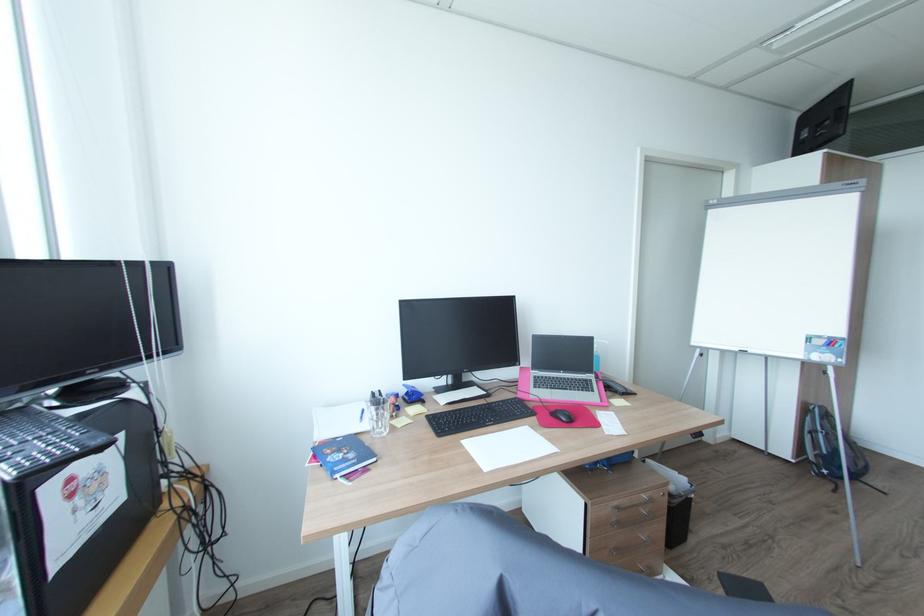
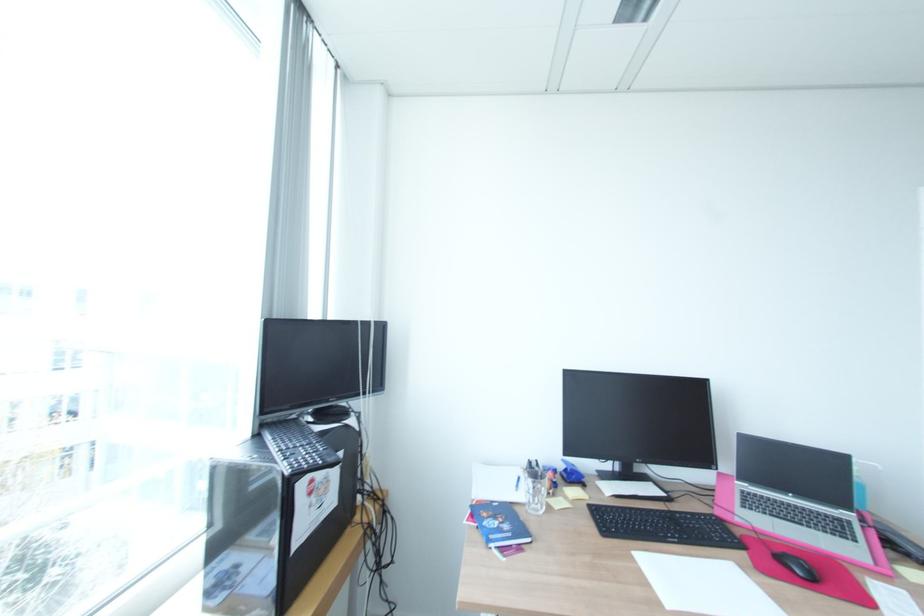
Question: Based on the continuous images, in which direction is the camera rotating? Reply with the corresponding letter.

Choices:
 (A) Left
 (B) Right
 (C) Up
 (D) Down

Answer: (A)